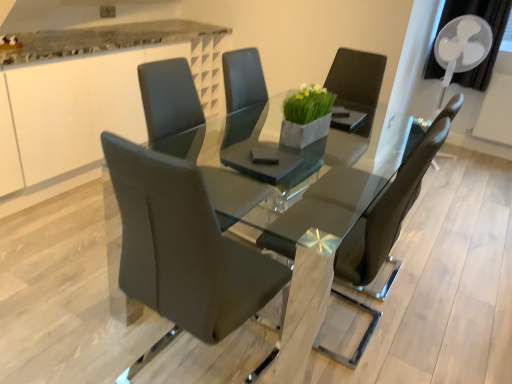
Image resolution: width=512 pixels, height=384 pixels. Find the location of `vacant space to the left of matte black chair at center, the third chair viewed from the back`. vacant space to the left of matte black chair at center, the third chair viewed from the back is located at coordinates (80, 332).